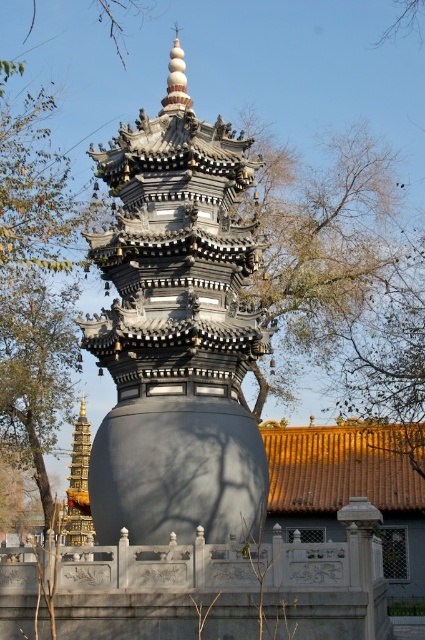
Is green leafy tree at left smaller than gold polished tower at lower left?

No, green leafy tree at left is not smaller than gold polished tower at lower left.

Describe the element at coordinates (36, 369) in the screenshot. The height and width of the screenshot is (640, 425). I see `green leafy tree at left` at that location.

Where is `green leafy tree at left`? green leafy tree at left is located at coordinates (36, 369).

Is the position of matte black pagoda at center more distant than that of green leafy tree at left?

No.

Which is more to the right, matte black pagoda at center or green leafy tree at left?

matte black pagoda at center

Between point (252, 518) and point (39, 332), which one is positioned behind?

Positioned behind is point (39, 332).

Locate an element on the screen. This screenshot has height=640, width=425. matte black pagoda at center is located at coordinates (175, 332).

Is matte black pagoda at center bigger than gold polished tower at lower left?

Yes, matte black pagoda at center is bigger than gold polished tower at lower left.

Locate an element on the screen. Image resolution: width=425 pixels, height=640 pixels. matte black pagoda at center is located at coordinates (175, 332).

Is point (215, 420) positioned after point (74, 445)?

No, (215, 420) is in front of (74, 445).

Where is `matte black pagoda at center`? matte black pagoda at center is located at coordinates (175, 332).